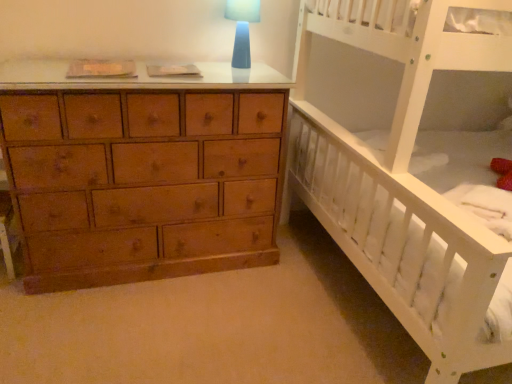
Measure the distance between blue glass lampshade at upper center and camera.

blue glass lampshade at upper center and camera are 1.82 meters apart from each other.

Identify the location of blue glass lampshade at upper center. The image size is (512, 384). (242, 28).

What do you see at coordinates (242, 28) in the screenshot? The image size is (512, 384). I see `blue glass lampshade at upper center` at bounding box center [242, 28].

This screenshot has height=384, width=512. What do you see at coordinates (409, 168) in the screenshot?
I see `white wooden bunk bed at right` at bounding box center [409, 168].

Locate an element on the screen. This screenshot has width=512, height=384. white wooden bunk bed at right is located at coordinates (409, 168).

In order to click on blue glass lampshade at upper center in this screenshot , I will do `click(242, 28)`.

Which object is positioned more to the right, white wooden bunk bed at right or blue glass lampshade at upper center?

Positioned to the right is white wooden bunk bed at right.

Which object is closer to the camera taking this photo, white wooden bunk bed at right or blue glass lampshade at upper center?

Positioned in front is white wooden bunk bed at right.

Does point (380, 213) appear closer or farther from the camera than point (232, 66)?

Clearly, point (380, 213) is closer to the camera than point (232, 66).

From the image's perspective, relative to blue glass lampshade at upper center, is white wooden bunk bed at right above or below?

Based on their image positions, white wooden bunk bed at right is located beneath blue glass lampshade at upper center.

From a real-world perspective, is white wooden bunk bed at right beneath blue glass lampshade at upper center?

Yes, from a real-world perspective, white wooden bunk bed at right is under blue glass lampshade at upper center.

Between white wooden bunk bed at right and blue glass lampshade at upper center, which one has smaller width?

blue glass lampshade at upper center is thinner.

Considering the sizes of objects white wooden bunk bed at right and blue glass lampshade at upper center in the image provided, who is shorter, white wooden bunk bed at right or blue glass lampshade at upper center?

With less height is blue glass lampshade at upper center.

Looking at the image, does white wooden bunk bed at right seem bigger or smaller compared to blue glass lampshade at upper center?

Clearly, white wooden bunk bed at right is larger in size than blue glass lampshade at upper center.

Is white wooden bunk bed at right completely or partially outside of blue glass lampshade at upper center?

Absolutely, white wooden bunk bed at right is external to blue glass lampshade at upper center.

Are white wooden bunk bed at right and blue glass lampshade at upper center located far from each other?

Actually, white wooden bunk bed at right and blue glass lampshade at upper center are a little close together.

Is white wooden bunk bed at right aimed at blue glass lampshade at upper center?

Yes, white wooden bunk bed at right is oriented towards blue glass lampshade at upper center.

What's the angular difference between white wooden bunk bed at right and blue glass lampshade at upper center's facing directions?

The facing directions of white wooden bunk bed at right and blue glass lampshade at upper center are 90 degrees apart.

Image resolution: width=512 pixels, height=384 pixels. Find the location of `table lamp above the white wooden bunk bed at right (from the image's perspective)`. table lamp above the white wooden bunk bed at right (from the image's perspective) is located at coordinates (242, 28).

Considering the positions of objects blue glass lampshade at upper center and white wooden bunk bed at right in the image provided, who is more to the right, blue glass lampshade at upper center or white wooden bunk bed at right?

white wooden bunk bed at right is more to the right.

Which object is further away from the camera taking this photo, blue glass lampshade at upper center or white wooden bunk bed at right?

Positioned behind is blue glass lampshade at upper center.

Is point (247, 47) in front of point (411, 53)?

No, it is not.

From the image's perspective, which object appears higher, blue glass lampshade at upper center or white wooden bunk bed at right?

→ From the image's view, blue glass lampshade at upper center is above.

From a real-world perspective, between blue glass lampshade at upper center and white wooden bunk bed at right, who is vertically lower?

From a 3D spatial view, white wooden bunk bed at right is below.

Is blue glass lampshade at upper center wider than white wooden bunk bed at right?

No, blue glass lampshade at upper center is not wider than white wooden bunk bed at right.

Can you confirm if blue glass lampshade at upper center is shorter than white wooden bunk bed at right?

Correct, blue glass lampshade at upper center is not as tall as white wooden bunk bed at right.

Does blue glass lampshade at upper center have a smaller size compared to white wooden bunk bed at right?

Yes.

Consider the image. Can we say blue glass lampshade at upper center lies outside white wooden bunk bed at right?

Yes.

Is there a large distance between blue glass lampshade at upper center and white wooden bunk bed at right?

No, blue glass lampshade at upper center is not far away from white wooden bunk bed at right.

Is blue glass lampshade at upper center positioned with its back to white wooden bunk bed at right?

blue glass lampshade at upper center is not turned away from white wooden bunk bed at right.

You are a GUI agent. You are given a task and a screenshot of the screen. Output one action in this format:
    pyautogui.click(x=<x>, y=<y>)
    Task: Click on the table lamp above the white wooden bunk bed at right (from the image's perspective)
    The width and height of the screenshot is (512, 384).
    Given the screenshot: What is the action you would take?
    pyautogui.click(x=242, y=28)

Where is `table lamp on the left of white wooden bunk bed at right`? table lamp on the left of white wooden bunk bed at right is located at coordinates (242, 28).

The width and height of the screenshot is (512, 384). In the image, there is a blue glass lampshade at upper center. In order to click on infant bed below it (from the image's perspective) in this screenshot , I will do `click(409, 168)`.